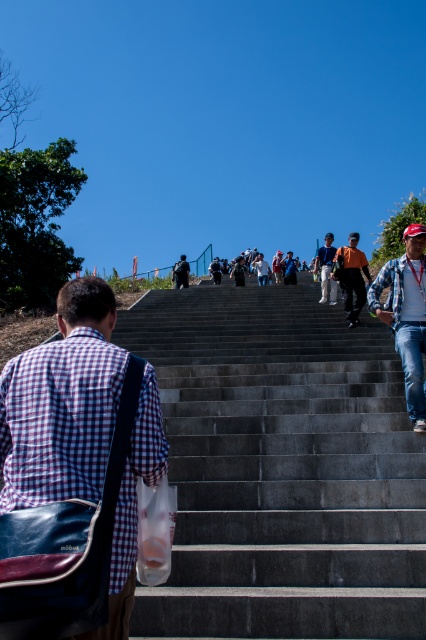
You are a photographer trying to capture the scene of the smooth concrete stairs at center and the dark gray jeans at center. Based on their heights, which object should you focus on first if you want to ensure both are in frame without moving the camera?

The smooth concrete stairs at center is not as tall as dark gray jeans at center, so you should focus on the dark gray jeans at center first to ensure both are in frame.

You are a photographer trying to capture a candid shot of the two people on the staircase. Since you want to ensure both the orange fabric shirt at center and the dark gray jeans at center are clearly visible in the frame, which clothing item should you focus on to ensure the entire person is in focus?

The orange fabric shirt at center is smaller than the dark gray jeans at center, so focusing on the dark gray jeans at center would ensure the entire person is in focus because it is larger and easier to capture clearly.